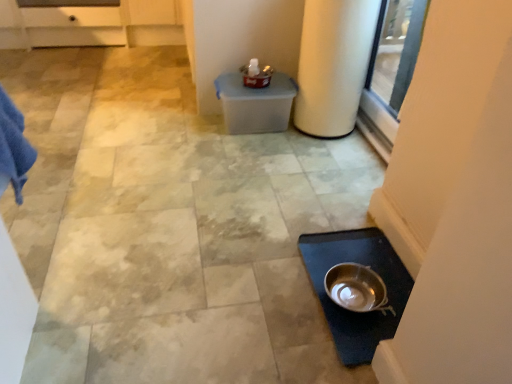
Find the location of `free space behind silver metallic mixing bowl at lower right`. free space behind silver metallic mixing bowl at lower right is located at coordinates (345, 246).